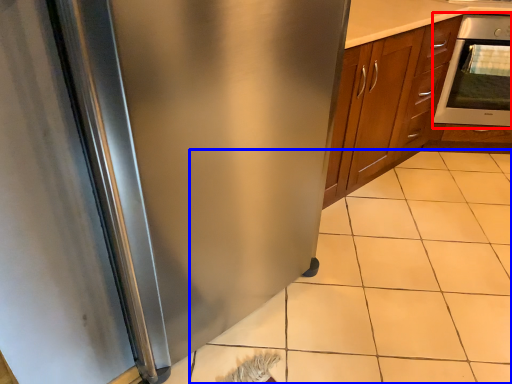
Question: Which object appears farthest to the camera in this image, oven (highlighted by a red box) or tile (highlighted by a blue box)?

Choices:
 (A) oven
 (B) tile

Answer: (A)